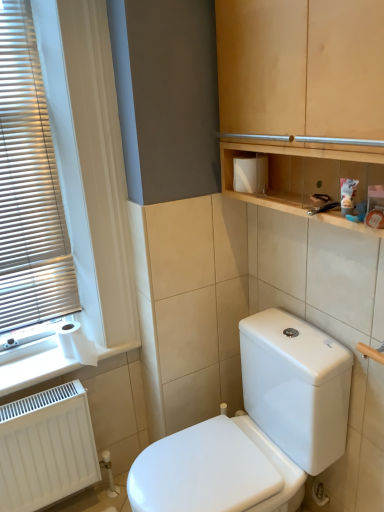
This screenshot has width=384, height=512. In order to click on vacant space situated above white paper at lower left (from a real-world perspective) in this screenshot , I will do `click(53, 365)`.